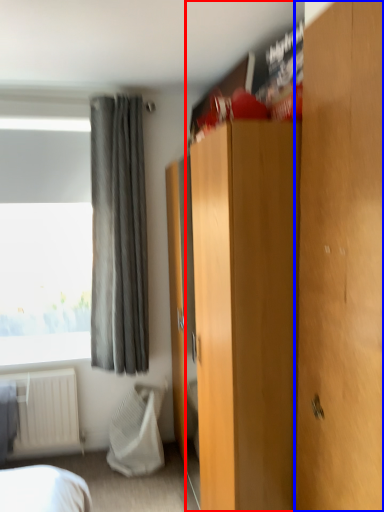
Question: Which point is further to the camera, dresser (highlighted by a red box) or door (highlighted by a blue box)?

Choices:
 (A) dresser
 (B) door

Answer: (A)